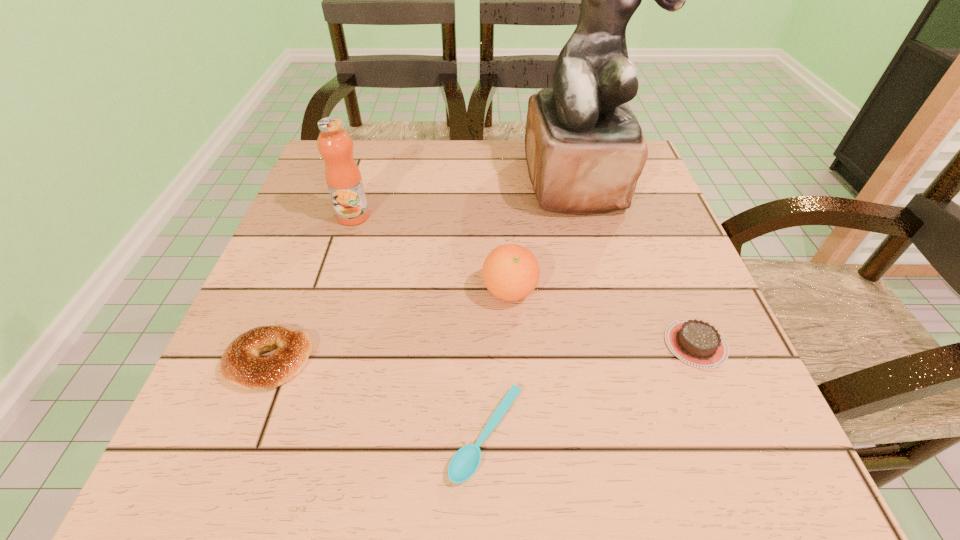
I want to click on vacant area in the image that satisfies the following two spatial constraints: 1. on the front side of the orange; 2. on the left side of the second tallest object, so click(x=329, y=291).